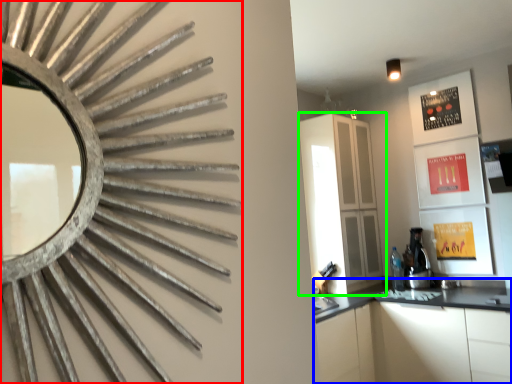
Question: Considering the real-world distances, which object is closest to mirror (highlighted by a red box)? cabinetry (highlighted by a blue box) or cabinetry (highlighted by a green box).

Choices:
 (A) cabinetry
 (B) cabinetry

Answer: (A)